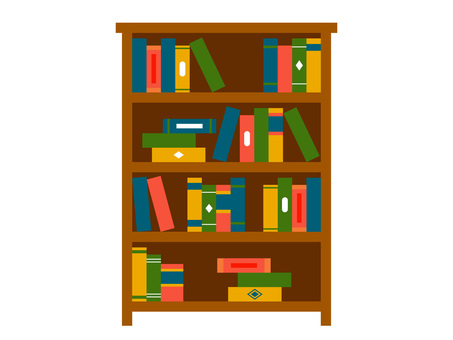
At what (x,y) coordinates should I click in order to perform the action: click on shelves. Please return your answer as a coordinate pair (x, y). This screenshot has width=453, height=340. Looking at the image, I should click on (230, 97), (225, 167), (233, 239), (242, 309).